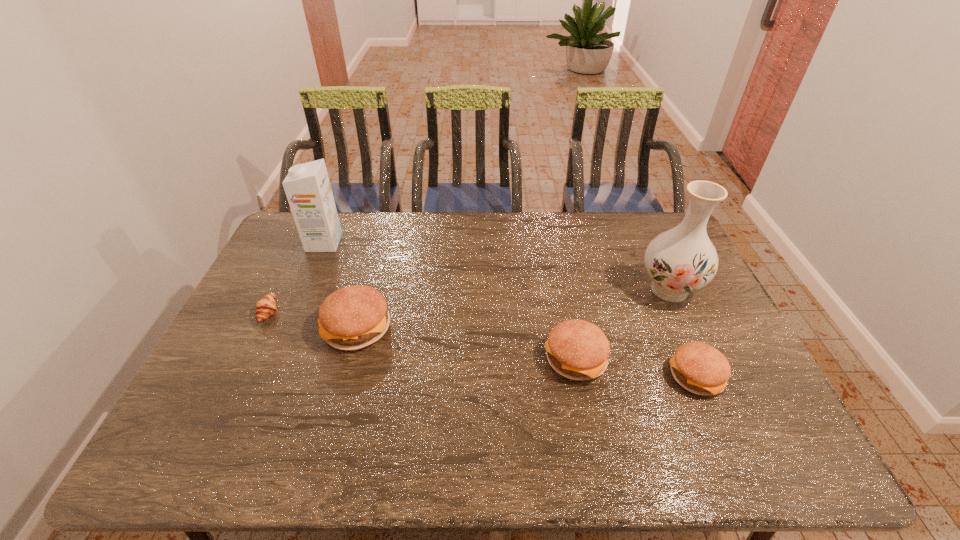
Locate an element on the screen. free space located on the right of the third shortest object is located at coordinates (699, 359).

This screenshot has width=960, height=540. In order to click on vacant space positioned on the front of the fifth tallest object in this screenshot , I will do `click(714, 418)`.

Locate an element on the screen. free region located on the front of the fifth shortest object is located at coordinates (292, 319).

I want to click on vacant area located on the back of the tallest object, so click(644, 234).

Locate an element on the screen. This screenshot has height=540, width=960. free space located on the front-facing side of the shortest object is located at coordinates (409, 312).

Where is `object that is at the far edge`? The height and width of the screenshot is (540, 960). object that is at the far edge is located at coordinates (307, 187).

Locate an element on the screen. This screenshot has width=960, height=540. object present at the near edge is located at coordinates (699, 368).

At what (x,y) coordinates should I click in order to perform the action: click on carton that is at the left edge. Please return your answer as a coordinate pair (x, y). Image resolution: width=960 pixels, height=540 pixels. Looking at the image, I should click on (307, 187).

Locate an element on the screen. pastry that is at the left edge is located at coordinates (266, 306).

The width and height of the screenshot is (960, 540). I want to click on hamburger situated at the right edge, so click(x=699, y=368).